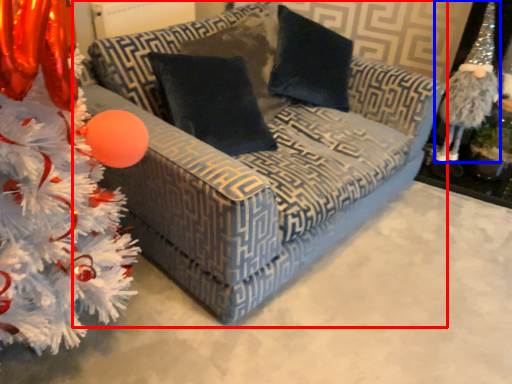
Question: Which object appears closest to the camera in this image, studio couch (highlighted by a red box) or toy (highlighted by a blue box)?

Choices:
 (A) studio couch
 (B) toy

Answer: (A)